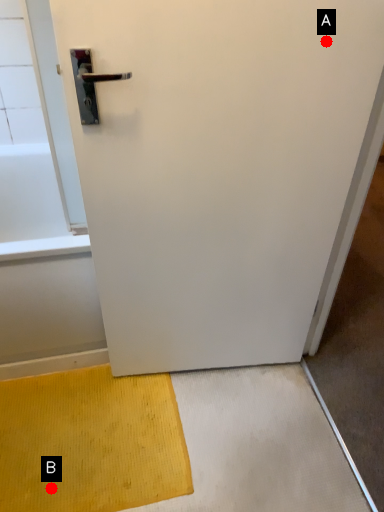
Question: Two points are circled on the image, labeled by A and B beside each circle. Which point is closer to the camera?

Choices:
 (A) A is closer
 (B) B is closer

Answer: (A)